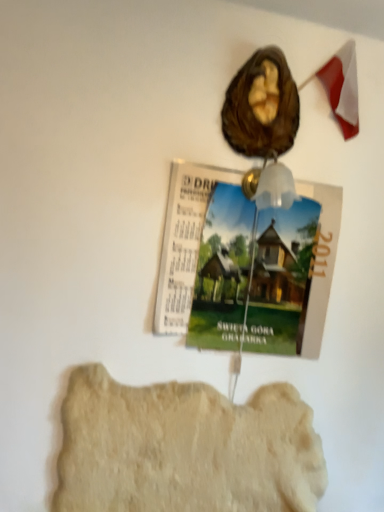
Image resolution: width=384 pixels, height=512 pixels. I want to click on light beige stone at lower center, so click(185, 448).

Identify the location of brown matte walnut at upper center. The width and height of the screenshot is (384, 512). (262, 106).

Where is `green paper magazine at upper center`? green paper magazine at upper center is located at coordinates tap(245, 264).

Is light beige stone at lower center not close to green paper magazine at upper center?

No, light beige stone at lower center is not far from green paper magazine at upper center.

Can you tell me how much light beige stone at lower center and green paper magazine at upper center differ in facing direction?

The angle between the facing direction of light beige stone at lower center and the facing direction of green paper magazine at upper center is 0.0345 degrees.

Is light beige stone at lower center not inside green paper magazine at upper center?

Yes, light beige stone at lower center is located beyond the bounds of green paper magazine at upper center.

From the image's perspective, would you say light beige stone at lower center is shown under green paper magazine at upper center?

Yes, from the image's perspective, light beige stone at lower center is below green paper magazine at upper center.

Considering the sizes of brown matte walnut at upper center and green paper magazine at upper center in the image, is brown matte walnut at upper center bigger or smaller than green paper magazine at upper center?

→ brown matte walnut at upper center is smaller than green paper magazine at upper center.

Would you say brown matte walnut at upper center is a long distance from green paper magazine at upper center?

No, there isn't a large distance between brown matte walnut at upper center and green paper magazine at upper center.

Which is correct: brown matte walnut at upper center is inside green paper magazine at upper center, or outside of it?

brown matte walnut at upper center is outside green paper magazine at upper center.

Looking at their sizes, would you say green paper magazine at upper center is wider or thinner than light beige stone at lower center?

green paper magazine at upper center is thinner than light beige stone at lower center.

Who is shorter, green paper magazine at upper center or light beige stone at lower center?

With less height is light beige stone at lower center.

In the image, there is a green paper magazine at upper center. At what (x,y) coordinates should I click in order to perform the action: click on rock formation below it (from the image's perspective). Please return your answer as a coordinate pair (x, y). This screenshot has height=512, width=384. Looking at the image, I should click on (185, 448).

Does brown matte walnut at upper center have a greater width compared to light beige stone at lower center?

Yes.

Identify the location of art lying on the right of light beige stone at lower center. (262, 106).

Is brown matte walnut at upper center beside light beige stone at lower center?

No, brown matte walnut at upper center is not in contact with light beige stone at lower center.

Looking at this image, from the image's perspective, is brown matte walnut at upper center located above light beige stone at lower center?

Correct, brown matte walnut at upper center appears higher than light beige stone at lower center in the image.

Does light beige stone at lower center lie behind brown matte walnut at upper center?

No, light beige stone at lower center is in front of brown matte walnut at upper center.

Considering the relative sizes of light beige stone at lower center and brown matte walnut at upper center in the image provided, is light beige stone at lower center shorter than brown matte walnut at upper center?

No.

Is light beige stone at lower center located outside brown matte walnut at upper center?

That's correct, light beige stone at lower center is outside of brown matte walnut at upper center.

Is light beige stone at lower center smaller than brown matte walnut at upper center?

Incorrect, light beige stone at lower center is not smaller in size than brown matte walnut at upper center.

Who is taller, green paper magazine at upper center or brown matte walnut at upper center?

With more height is green paper magazine at upper center.

Consider the image. From a real-world perspective, is green paper magazine at upper center over brown matte walnut at upper center?

Incorrect, from a real-world perspective, green paper magazine at upper center is lower than brown matte walnut at upper center.

How much distance is there between green paper magazine at upper center and brown matte walnut at upper center?

A distance of 13.97 inches exists between green paper magazine at upper center and brown matte walnut at upper center.

Which object is positioned more to the right, green paper magazine at upper center or brown matte walnut at upper center?

From the viewer's perspective, brown matte walnut at upper center appears more on the right side.

Where is `rock formation below the green paper magazine at upper center (from the image's perspective)`? rock formation below the green paper magazine at upper center (from the image's perspective) is located at coordinates (185, 448).

There is a green paper magazine at upper center. In order to click on art above it (from a real-world perspective) in this screenshot , I will do `click(262, 106)`.

Which object lies nearer to the anchor point green paper magazine at upper center, brown matte walnut at upper center or light beige stone at lower center?

Based on the image, brown matte walnut at upper center appears to be nearer to green paper magazine at upper center.

When comparing their distances from brown matte walnut at upper center, does green paper magazine at upper center or light beige stone at lower center seem closer?

Based on the image, green paper magazine at upper center appears to be nearer to brown matte walnut at upper center.

Estimate the real-world distances between objects in this image. Which object is closer to light beige stone at lower center, green paper magazine at upper center or brown matte walnut at upper center?

The object closer to light beige stone at lower center is green paper magazine at upper center.

Which object lies nearer to the anchor point light beige stone at lower center, brown matte walnut at upper center or green paper magazine at upper center?

The object closer to light beige stone at lower center is green paper magazine at upper center.

Which object lies further to the anchor point brown matte walnut at upper center, light beige stone at lower center or green paper magazine at upper center?

The object further to brown matte walnut at upper center is light beige stone at lower center.

Considering their positions, is light beige stone at lower center positioned closer to green paper magazine at upper center than brown matte walnut at upper center?

Among the two, brown matte walnut at upper center is located nearer to green paper magazine at upper center.

This screenshot has height=512, width=384. In order to click on magazine that lies between brown matte walnut at upper center and light beige stone at lower center from top to bottom in this screenshot , I will do `click(245, 264)`.